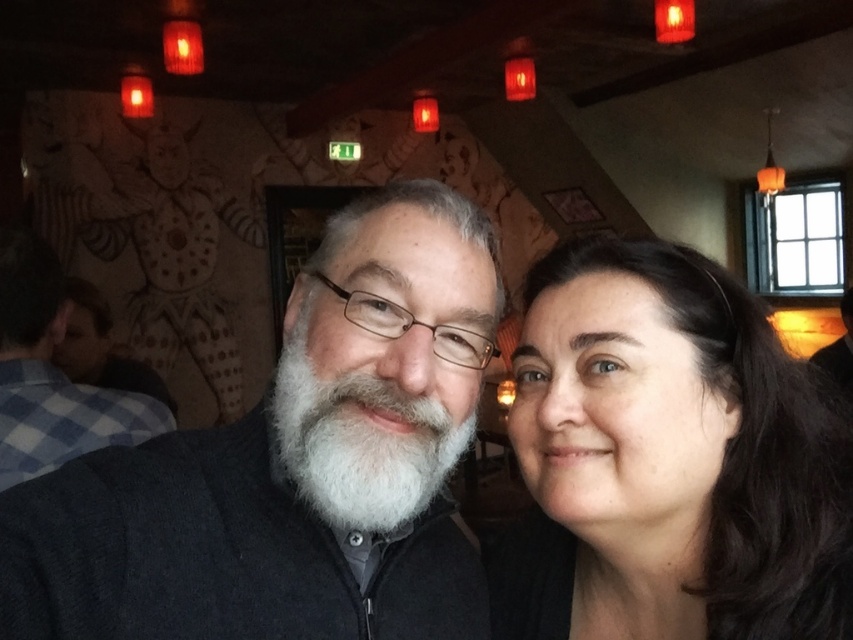
Question: Is smooth dark hair at right above white beard at center?

Choices:
 (A) no
 (B) yes

Answer: (A)

Question: Which object appears farthest from the camera in this image?

Choices:
 (A) dark gray sweater at center
 (B) smooth dark hair at right
 (C) white matte beard at center

Answer: (B)

Question: Considering the real-world distances, which object is closest to the white beard at center?

Choices:
 (A) smooth dark hair at right
 (B) white matte beard at center
 (C) dark gray sweater at center

Answer: (C)

Question: In this image, where is white matte beard at center located relative to white beard at center?

Choices:
 (A) above
 (B) below

Answer: (B)

Question: Can you confirm if dark gray sweater at center is positioned to the right of white beard at center?

Choices:
 (A) yes
 (B) no

Answer: (A)

Question: Which point is farther to the camera?

Choices:
 (A) white beard at center
 (B) white matte beard at center

Answer: (A)